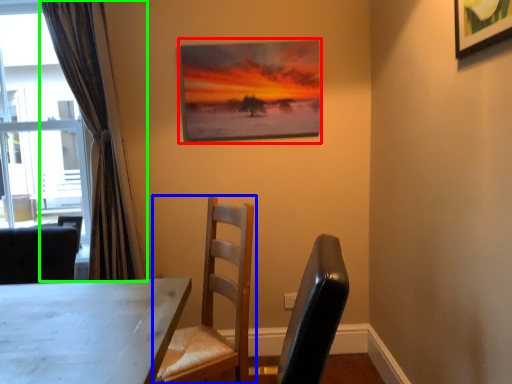
Question: Which is farther away from picture frame (highlighted by a red box)? chair (highlighted by a blue box) or curtain (highlighted by a green box)?

Choices:
 (A) chair
 (B) curtain

Answer: (A)